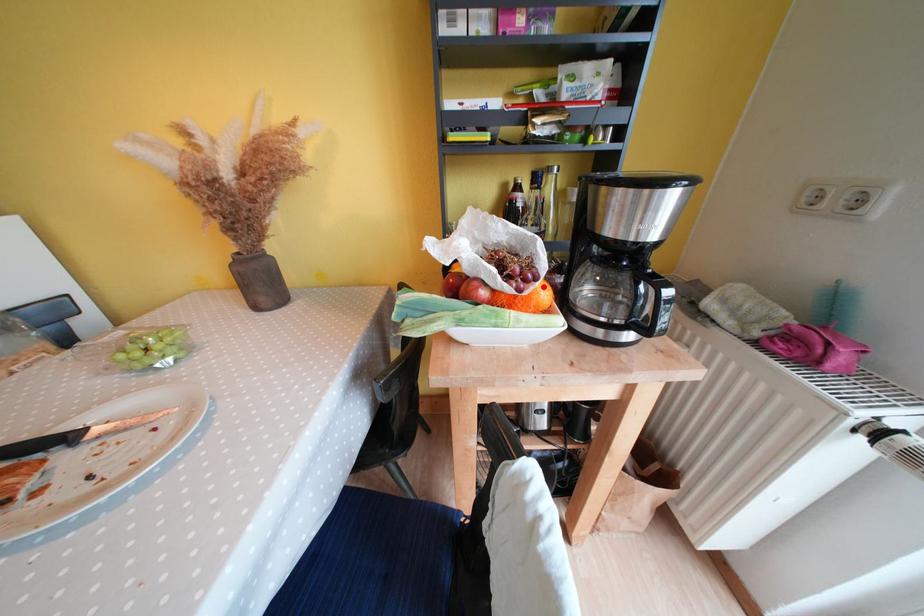
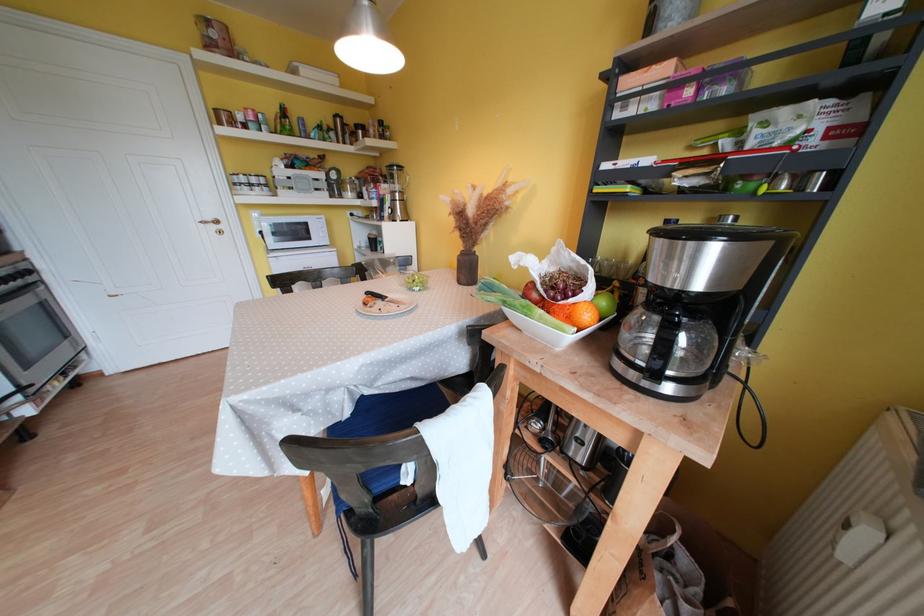
Where in the second image is the point corresponding to the highlighted location from the first image?

(578, 302)